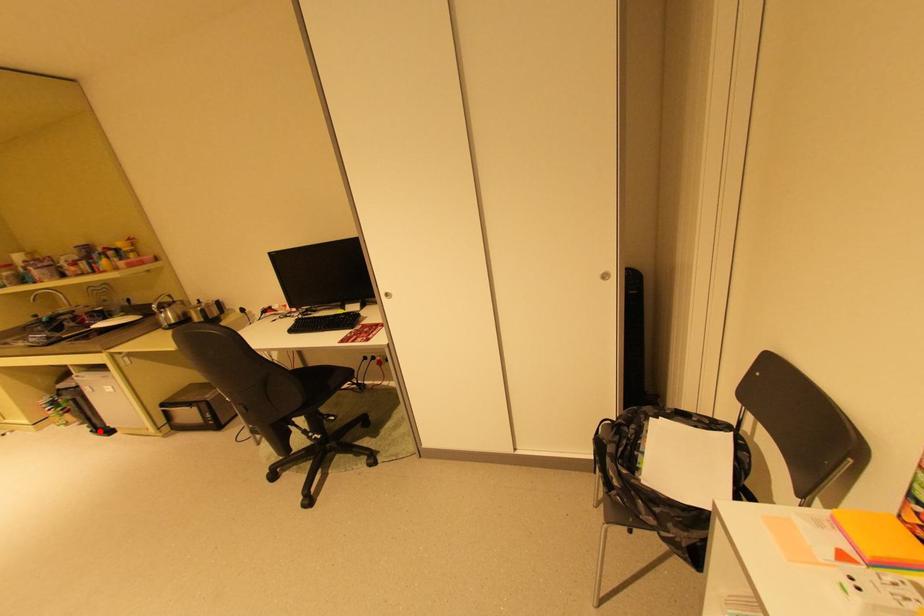
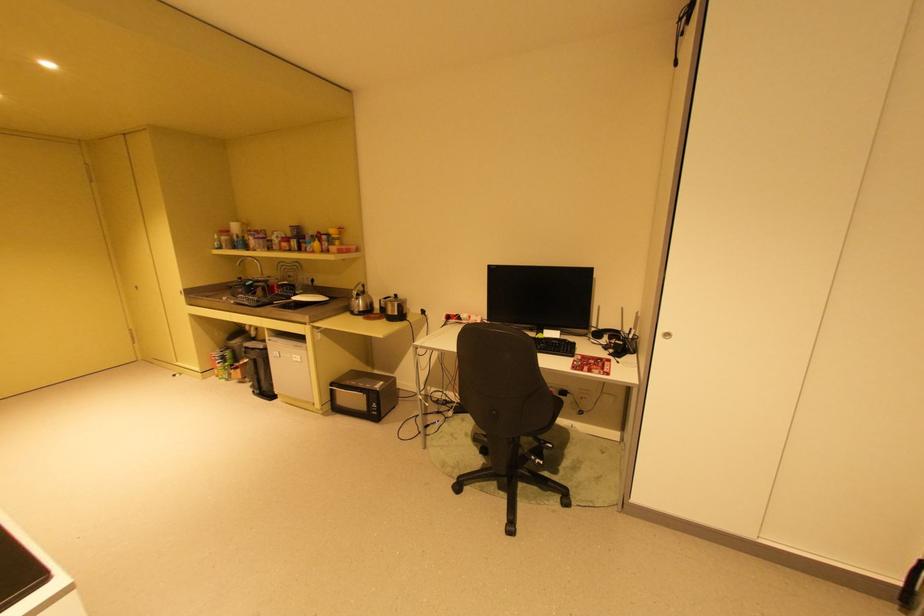
Locate, in the second image, the point that corresponds to the highlighted location in the first image.

(261, 392)